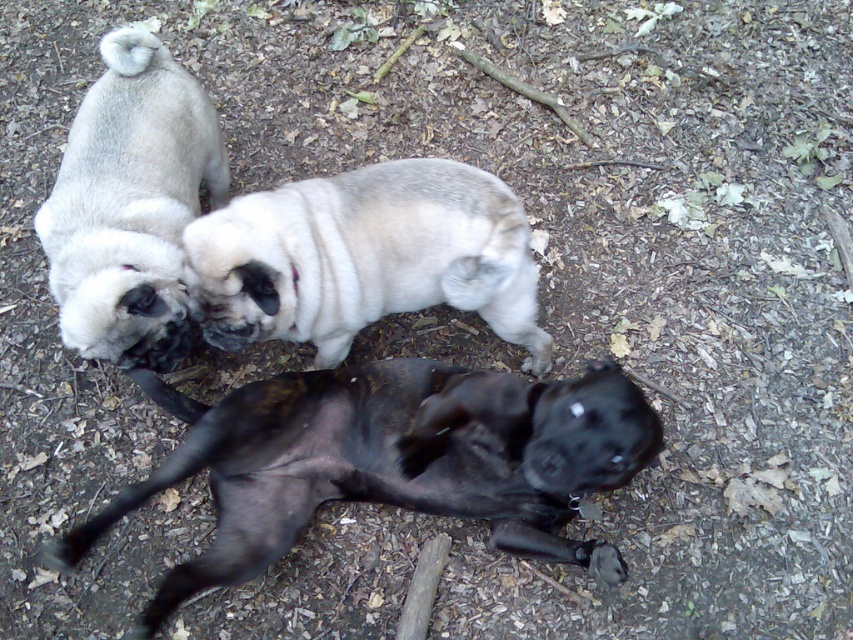
Question: Which of the following is the closest to the observer?

Choices:
 (A) black smooth dog at center
 (B) fuzzy beige dog at upper center
 (C) matte white pug at upper left

Answer: (A)

Question: Which of the following is the closest to the observer?

Choices:
 (A) (113, 134)
 (B) (270, 515)
 (C) (283, 220)

Answer: (B)

Question: Does black smooth dog at center appear on the right side of matte white pug at upper left?

Choices:
 (A) yes
 (B) no

Answer: (A)

Question: Can you confirm if fuzzy beige dog at upper center is positioned to the right of matte white pug at upper left?

Choices:
 (A) yes
 (B) no

Answer: (A)

Question: Can you confirm if black smooth dog at center is bigger than matte white pug at upper left?

Choices:
 (A) yes
 (B) no

Answer: (A)

Question: Considering the real-world distances, which object is closest to the matte white pug at upper left?

Choices:
 (A) fuzzy beige dog at upper center
 (B) black smooth dog at center

Answer: (A)